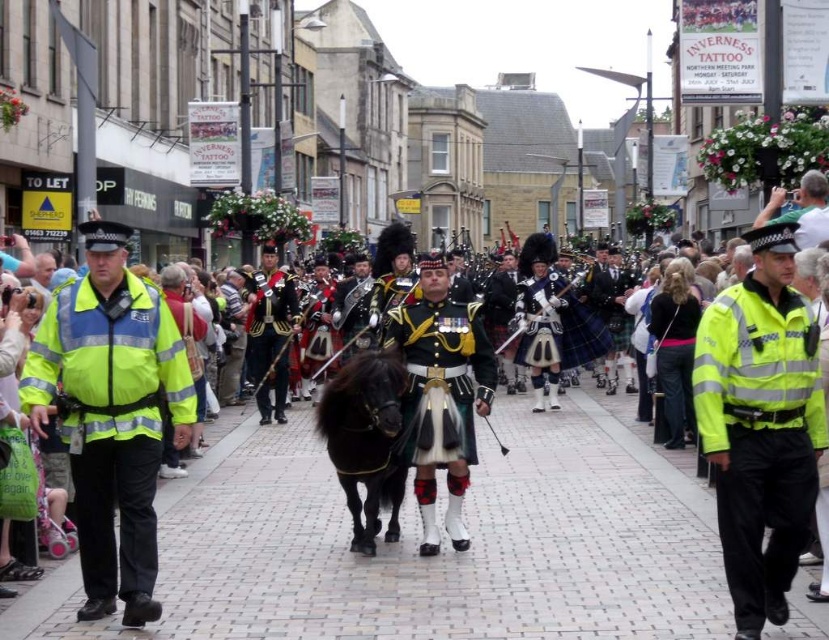
Is brick pavement at center bigger than shiny black uniform at center?

Correct, brick pavement at center is larger in size than shiny black uniform at center.

Which is more to the right, brick pavement at center or shiny black uniform at center?

brick pavement at center

I want to click on brick pavement at center, so 418,541.

Does brick pavement at center have a lesser height compared to shiny gold uniform at center?

Correct, brick pavement at center is not as tall as shiny gold uniform at center.

Is brick pavement at center further to the viewer compared to shiny gold uniform at center?

No, it is not.

Where is `brick pavement at center`? Image resolution: width=829 pixels, height=640 pixels. brick pavement at center is located at coordinates (418, 541).

What are the coordinates of `brick pavement at center` in the screenshot? It's located at (418, 541).

Which is more to the right, high-visibility reflective jacket at center or shiny gold uniform at center?

high-visibility reflective jacket at center is more to the right.

Does point (748, 342) lie in front of point (449, 307)?

Yes, point (748, 342) is closer to viewer.

Does point (709, 326) come behind point (410, 406)?

No, it is in front of (410, 406).

Locate an element on the screen. This screenshot has height=640, width=829. high-visibility reflective jacket at center is located at coordinates (760, 424).